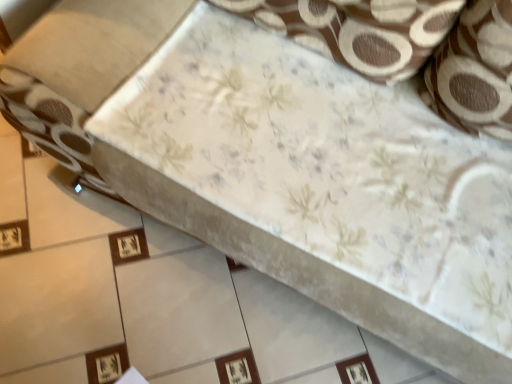
What do you see at coordinates (359, 30) in the screenshot?
I see `floral fabric pillow at upper center` at bounding box center [359, 30].

Where is `floral fabric pillow at upper center`? This screenshot has height=384, width=512. floral fabric pillow at upper center is located at coordinates (359, 30).

In order to face floral fabric pillow at upper center, should I rotate leftwards or rightwards?

Rotate right and turn 7.940 degrees.

The width and height of the screenshot is (512, 384). Identify the location of floral fabric pillow at upper center. (359, 30).